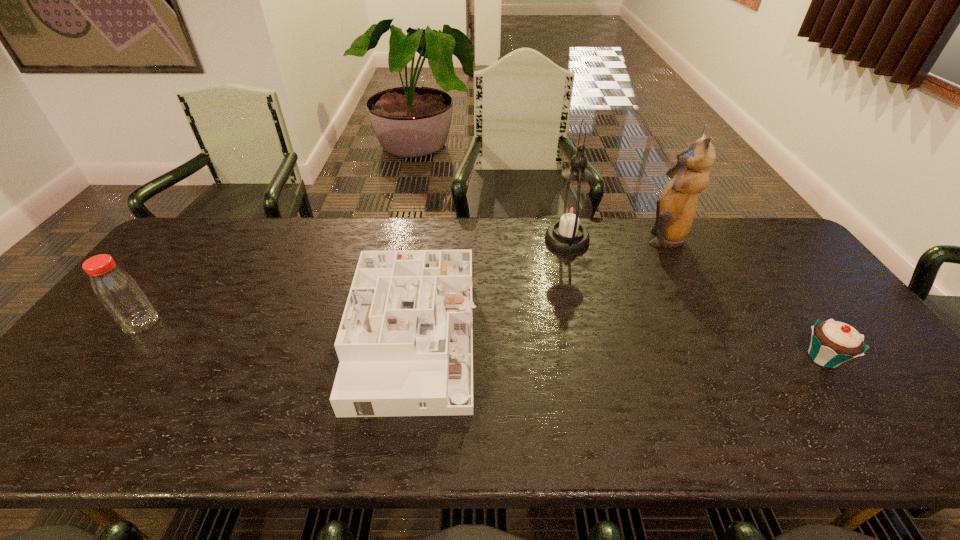
Locate an element on the screen. vacant space located 0.070m on the right of the leftmost object is located at coordinates (183, 322).

You are a GUI agent. You are given a task and a screenshot of the screen. Output one action in this format:
    pyautogui.click(x=<x>, y=<y>)
    Task: Click on the free point located on the left of the second object from left to right
    
    Given the screenshot: What is the action you would take?
    pyautogui.click(x=311, y=341)

The width and height of the screenshot is (960, 540). Find the location of `free spot located on the back of the rightmost object`. free spot located on the back of the rightmost object is located at coordinates (780, 296).

This screenshot has height=540, width=960. I want to click on oil lamp located at the far edge, so click(571, 210).

Where is `cat at the far edge`? This screenshot has height=540, width=960. cat at the far edge is located at coordinates (675, 212).

Where is `object positioned at the near edge`? Image resolution: width=960 pixels, height=540 pixels. object positioned at the near edge is located at coordinates (405, 343).

Identify the location of object present at the left edge. This screenshot has height=540, width=960. (118, 292).

The image size is (960, 540). Identify the location of object at the right edge. (832, 343).

In the image, there is a desktop. At what (x,y) coordinates should I click in order to perform the action: click on vacant space at the far edge. Please return your answer as a coordinate pair (x, y). Image resolution: width=960 pixels, height=540 pixels. Looking at the image, I should click on (457, 249).

In order to click on vacant position at the near edge of the desktop in this screenshot , I will do `click(327, 423)`.